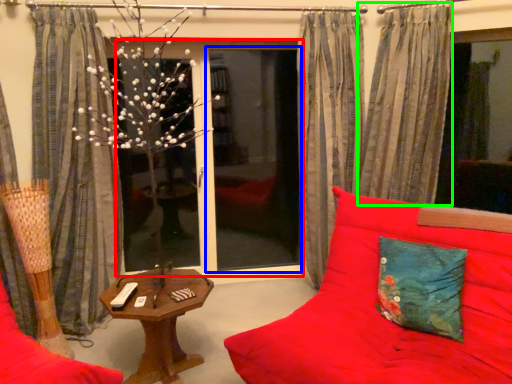
Question: Which object is positioned farthest from window screen (highlighted by a red box)? Select from screen door (highlighted by a blue box) and curtain (highlighted by a green box).

Choices:
 (A) screen door
 (B) curtain

Answer: (B)